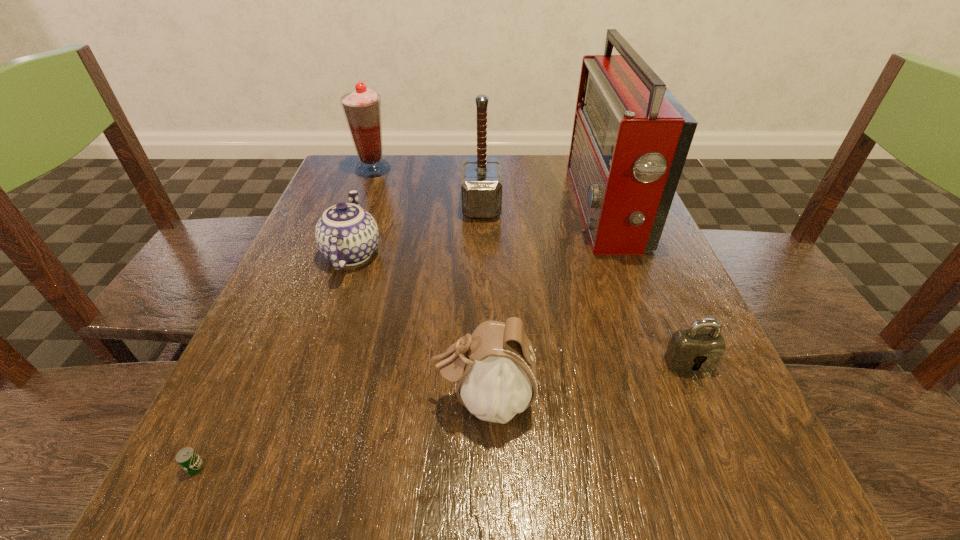
At what (x,y) coordinates should I click in order to perform the action: click on vacant space located on the back of the leftmost object. Please return your answer as a coordinate pair (x, y). This screenshot has height=540, width=960. Looking at the image, I should click on (232, 390).

I want to click on radio receiver at the far edge, so click(631, 137).

Identify the location of hammer positioned at the far edge. The image size is (960, 540). (481, 187).

The image size is (960, 540). In order to click on smoothie that is at the far edge in this screenshot , I will do `click(362, 108)`.

Where is `object present at the near edge`? This screenshot has width=960, height=540. object present at the near edge is located at coordinates (187, 458).

This screenshot has height=540, width=960. I want to click on smoothie located in the left edge section of the desktop, so pyautogui.click(x=362, y=108).

Locate an element on the screen. The image size is (960, 540). chinaware positioned at the left edge is located at coordinates (347, 235).

Find the location of a particular element. This screenshot has width=960, height=540. beer can positioned at the left edge is located at coordinates tap(187, 458).

Where is `radio receiver located in the right edge section of the desktop`? This screenshot has height=540, width=960. radio receiver located in the right edge section of the desktop is located at coordinates (631, 137).

At what (x,y) coordinates should I click in order to perform the action: click on padlock at the right edge. Please return your answer as a coordinate pair (x, y). Looking at the image, I should click on pyautogui.click(x=693, y=350).